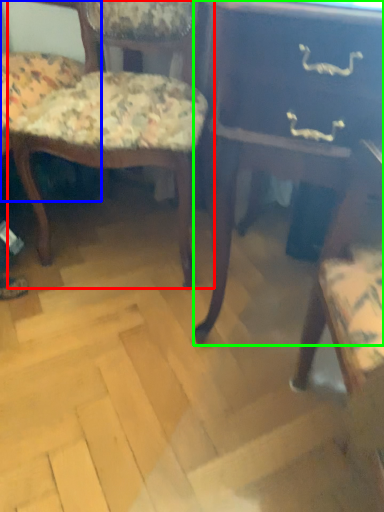
Question: Considering the real-world distances, which object is farthest from chair (highlighted by a red box)? chair (highlighted by a blue box) or table (highlighted by a green box)?

Choices:
 (A) chair
 (B) table

Answer: (B)